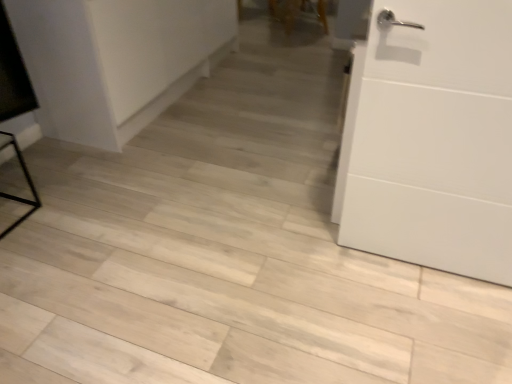
Locate an element on the screen. This screenshot has height=384, width=512. white matte cabinet at upper left is located at coordinates (116, 60).

Where is `white matte cabinet at upper left`? The image size is (512, 384). white matte cabinet at upper left is located at coordinates (116, 60).

Is wooden chair at upper center oriented towards white matte door at right?

No, wooden chair at upper center is not aimed at white matte door at right.

From a real-world perspective, is wooden chair at upper center positioned under white matte door at right based on gravity?

Yes, from a real-world perspective, wooden chair at upper center is beneath white matte door at right.

Which is farther from the camera, [290,8] or [383,34]?

The point [290,8] is farther.

Considering the relative sizes of wooden chair at upper center and white matte door at right in the image provided, is wooden chair at upper center wider than white matte door at right?

Indeed, wooden chair at upper center has a greater width compared to white matte door at right.

Is white matte cabinet at upper left positioned with its back to white matte door at right?

No, white matte cabinet at upper left is not facing the opposite direction of white matte door at right.

From the image's perspective, relative to white matte door at right, is white matte cabinet at upper left above or below?

Clearly, from the image's perspective, white matte cabinet at upper left is above white matte door at right.

Which object is positioned more to the right, white matte cabinet at upper left or white matte door at right?

From the viewer's perspective, white matte door at right appears more on the right side.

From a real-world perspective, is white matte cabinet at upper left above or below white matte door at right?

From a real-world perspective, white matte cabinet at upper left is physically below white matte door at right.

Is white matte cabinet at upper left located outside wooden chair at upper center?

Yes, white matte cabinet at upper left is not within wooden chair at upper center.

From a real-world perspective, is white matte cabinet at upper left positioned over wooden chair at upper center based on gravity?

Yes, from a real-world perspective, white matte cabinet at upper left is above wooden chair at upper center.

Is white matte cabinet at upper left positioned with its back to wooden chair at upper center?

No, white matte cabinet at upper left is not facing the opposite direction of wooden chair at upper center.

Are white matte cabinet at upper left and wooden chair at upper center far apart?

That's right, there is a large distance between white matte cabinet at upper left and wooden chair at upper center.

Which point is more forward, (443,164) or (160,42)?

The point (443,164) is in front.

Does white matte door at right come behind white matte cabinet at upper left?

No, white matte door at right is closer to the viewer.

Is white matte door at right facing towards white matte cabinet at upper left?

No, white matte door at right is not aimed at white matte cabinet at upper left.

Where is `chair behind the white matte door at right`? The width and height of the screenshot is (512, 384). chair behind the white matte door at right is located at coordinates (285, 12).

Which object is wider, white matte door at right or wooden chair at upper center?

wooden chair at upper center is wider.

From a real-world perspective, is white matte door at right under wooden chair at upper center?

No.

Is white matte door at right facing away from wooden chair at upper center?

Yes, white matte door at right's orientation is away from wooden chair at upper center.

From a real-world perspective, is wooden chair at upper center physically located above or below white matte cabinet at upper left?

wooden chair at upper center is below white matte cabinet at upper left.

Is wooden chair at upper center located outside white matte cabinet at upper left?

Indeed, wooden chair at upper center is completely outside white matte cabinet at upper left.

From the image's perspective, would you say wooden chair at upper center is shown under white matte cabinet at upper left?

No, from the image's perspective, wooden chair at upper center is not below white matte cabinet at upper left.

Is wooden chair at upper center next to white matte cabinet at upper left?

No, wooden chair at upper center is not making contact with white matte cabinet at upper left.

I want to click on door above the wooden chair at upper center (from a real-world perspective), so click(x=432, y=139).

The image size is (512, 384). Identify the location of cabinetry to the left of white matte door at right. (116, 60).

Based on their spatial positions, is wooden chair at upper center or white matte door at right further from white matte cabinet at upper left?

The object further to white matte cabinet at upper left is wooden chair at upper center.

Based on their spatial positions, is white matte door at right or white matte cabinet at upper left closer to wooden chair at upper center?

white matte cabinet at upper left is positioned closer to the anchor wooden chair at upper center.

Estimate the real-world distances between objects in this image. Which object is further from white matte door at right, wooden chair at upper center or white matte cabinet at upper left?

Among the two, wooden chair at upper center is located further to white matte door at right.

Which object lies nearer to the anchor point white matte door at right, white matte cabinet at upper left or wooden chair at upper center?

white matte cabinet at upper left is positioned closer to the anchor white matte door at right.

Estimate the real-world distances between objects in this image. Which object is further from wooden chair at upper center, white matte cabinet at upper left or white matte door at right?

Based on the image, white matte door at right appears to be further to wooden chair at upper center.

Based on their spatial positions, is white matte door at right or wooden chair at upper center closer to white matte cabinet at upper left?

Among the two, white matte door at right is located nearer to white matte cabinet at upper left.

The width and height of the screenshot is (512, 384). Identify the location of cabinetry between white matte door at right and wooden chair at upper center along the z-axis. (116, 60).